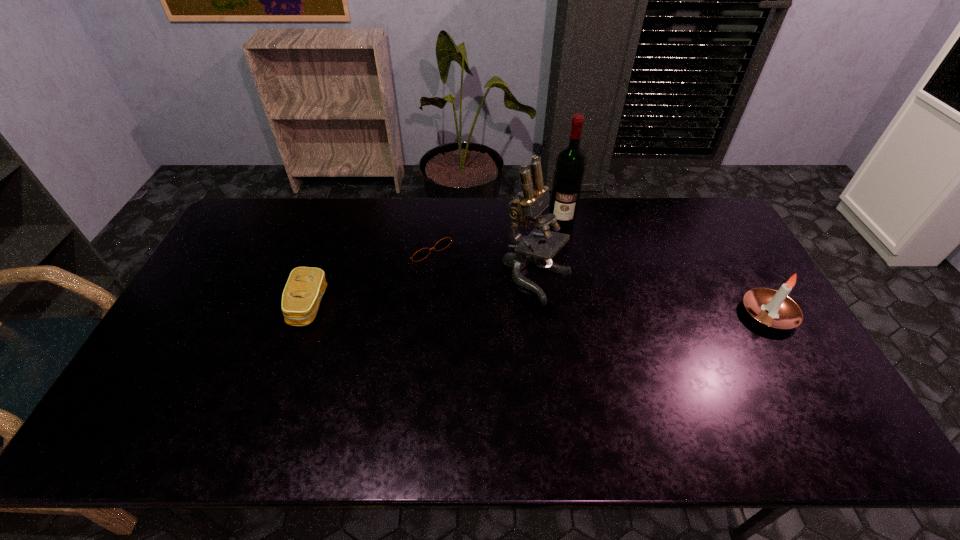
Where is `vacant point located on the zipper side of the clutch bag`? vacant point located on the zipper side of the clutch bag is located at coordinates (216, 306).

The height and width of the screenshot is (540, 960). I want to click on vacant space positioned on the front of the third tallest object, so click(x=804, y=376).

The height and width of the screenshot is (540, 960). In order to click on vacant space located on the face of the shortest object in this screenshot , I will do `click(516, 335)`.

Identify the location of vacant space situated on the face of the shortest object. (460, 280).

Where is `free spot located 0.200m on the face of the shortest object`? Image resolution: width=960 pixels, height=540 pixels. free spot located 0.200m on the face of the shortest object is located at coordinates (477, 297).

Find the location of a particular element. The image size is (960, 540). vacant region located 0.400m on the front and back of the farthest object is located at coordinates (560, 315).

Where is `free spot located 0.120m on the front and back of the farthest object`? This screenshot has height=540, width=960. free spot located 0.120m on the front and back of the farthest object is located at coordinates (561, 251).

Locate an element on the screen. vacant space located on the front and back of the farthest object is located at coordinates (562, 245).

Where is `free space located 0.160m at the eyepieces of the microscope`? This screenshot has width=960, height=540. free space located 0.160m at the eyepieces of the microscope is located at coordinates (617, 318).

This screenshot has width=960, height=540. Identify the location of free point located at the eyepieces of the microscope. (624, 321).